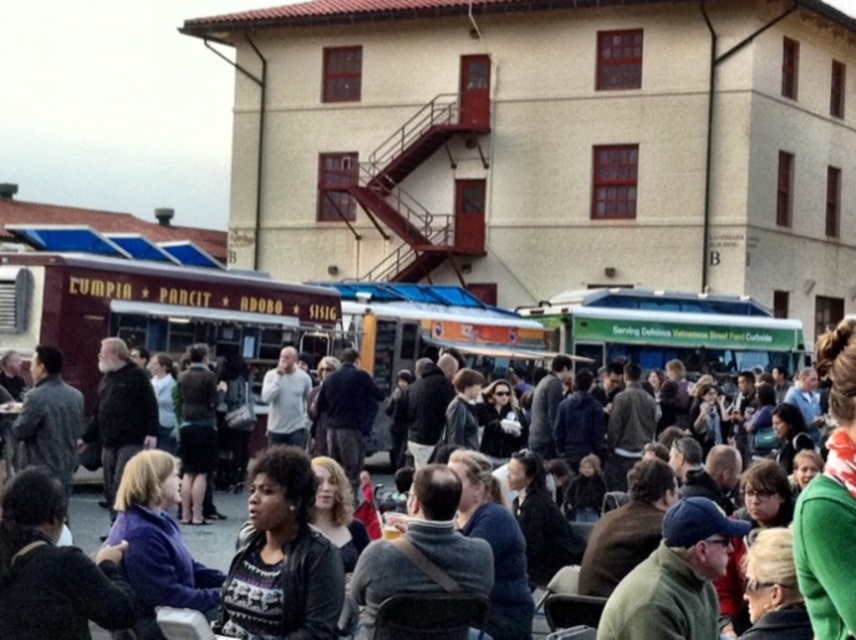
You are a food truck owner who wants to park your new truck between the matte red food truck at center and the dark gray jacket at center. Based on the scene, can you safely park there without blocking the path? Explain your reasoning.

The matte red food truck at center is positioned on the left side of dark gray jacket at center. Since the matte red food truck at center is already to the left of the dark gray jacket at center, there is likely enough space between them to park your truck without blocking the path, provided the distance between them is sufficient for your truck size.

You are a food truck operator who just arrived at the event. You notice the matte red food truck at center and the dark gray jacket at center. Which object is taller?

The matte red food truck at center is taller than the dark gray jacket at center.

You are a food truck operator who just arrived at the event. You notice the matte red food truck at center and the dark gray jacket at center. From your current position, which object is closer to you?

The matte red food truck at center is closer to you because the dark gray jacket at center is behind it.